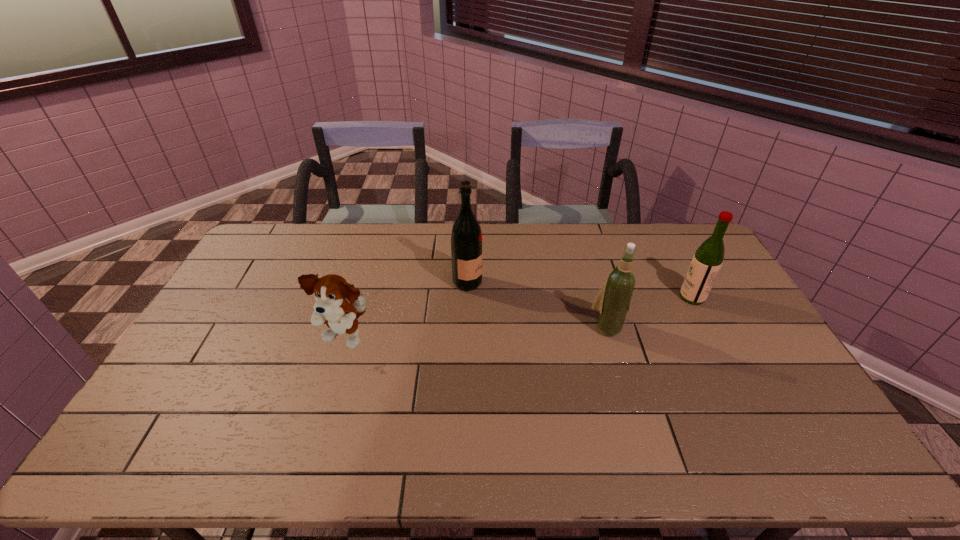
Find the location of a particular element. The image size is (960, 540). object identified as the second closest to the left liquor is located at coordinates (613, 300).

In order to click on free space that satisfies the following two spatial constraints: 1. on the label of the shorter liquor; 2. on the face of the leftmost object in this screenshot , I will do `click(714, 339)`.

At what (x,y) coordinates should I click in order to perform the action: click on vacant area that satisfies the following two spatial constraints: 1. on the label of the right liquor; 2. on the front-facing side of the wine bottle. Please return your answer as a coordinate pair (x, y). This screenshot has height=540, width=960. Looking at the image, I should click on (708, 327).

The width and height of the screenshot is (960, 540). I want to click on free region that satisfies the following two spatial constraints: 1. on the front-facing side of the taller liquor; 2. on the face of the puppy, so (x=466, y=339).

Where is `free region that satisfies the following two spatial constraints: 1. on the label of the right liquor; 2. on the front-facing side of the third object from left to right`? The height and width of the screenshot is (540, 960). free region that satisfies the following two spatial constraints: 1. on the label of the right liquor; 2. on the front-facing side of the third object from left to right is located at coordinates (708, 327).

You are a GUI agent. You are given a task and a screenshot of the screen. Output one action in this format:
    pyautogui.click(x=<x>, y=<y>)
    Task: Click on the free spot that satisfies the following two spatial constraints: 1. on the label of the shorter liquor; 2. on the front-facing side of the wine bottle
    The width and height of the screenshot is (960, 540).
    Given the screenshot: What is the action you would take?
    pyautogui.click(x=708, y=327)

You are a GUI agent. You are given a task and a screenshot of the screen. Output one action in this format:
    pyautogui.click(x=<x>, y=<y>)
    Task: Click on the vacant space that satisfies the following two spatial constraints: 1. on the label of the rightmost object; 2. on the front-facing side of the wine bottle
    
    Given the screenshot: What is the action you would take?
    pyautogui.click(x=708, y=327)